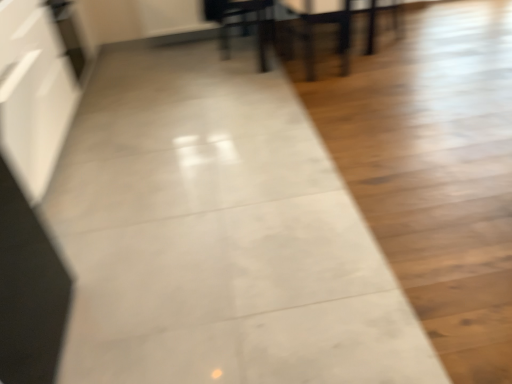
Question: In terms of size, does matte black armchair at upper center appear bigger or smaller than wooden table at center?

Choices:
 (A) big
 (B) small

Answer: (B)

Question: Does point (309, 72) appear closer or farther from the camera than point (391, 13)?

Choices:
 (A) closer
 (B) farther

Answer: (A)

Question: Which is farther from the matte black dining chair at upper center?

Choices:
 (A) matte black chair at upper right
 (B) wooden table at center
 (C) matte black armchair at upper center

Answer: (A)

Question: Estimate the real-world distances between objects in this image. Which object is farther from the matte black chair at upper right?

Choices:
 (A) wooden table at center
 (B) matte black dining chair at upper center
 (C) matte black armchair at upper center

Answer: (B)